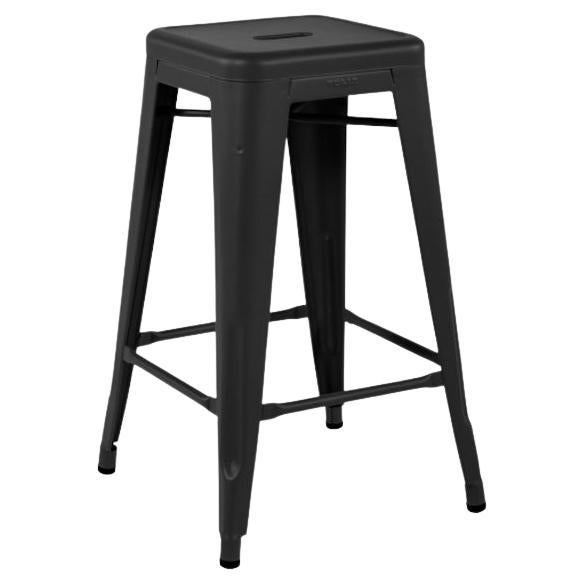
This screenshot has height=584, width=584. I want to click on small vertical line at the bottom of the seat, so click(x=156, y=66), click(x=290, y=89), click(x=392, y=75).